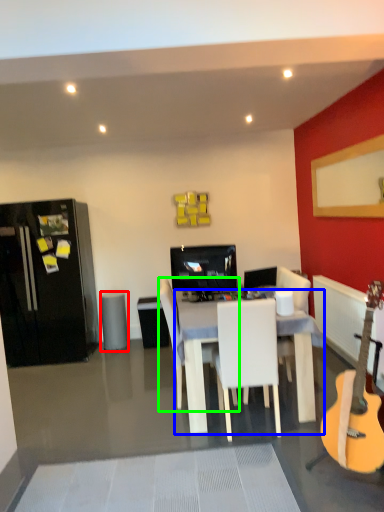
Question: Estimate the real-world distances between objects in this image. Which object is farther from trash bin/can (highlighted by a red box), desk (highlighted by a blue box) or chair (highlighted by a green box)?

Choices:
 (A) desk
 (B) chair

Answer: (A)